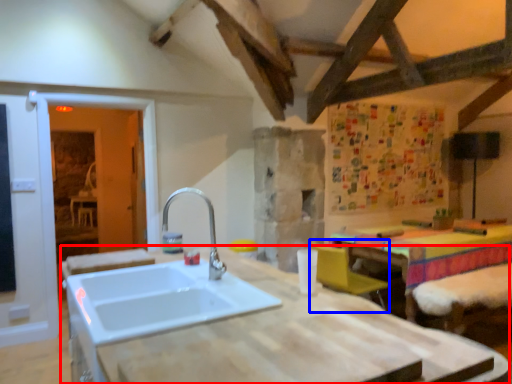
Question: Which of the following is the farthest to the observer, countertop (highlighted by a red box) or armchair (highlighted by a blue box)?

Choices:
 (A) countertop
 (B) armchair

Answer: (B)